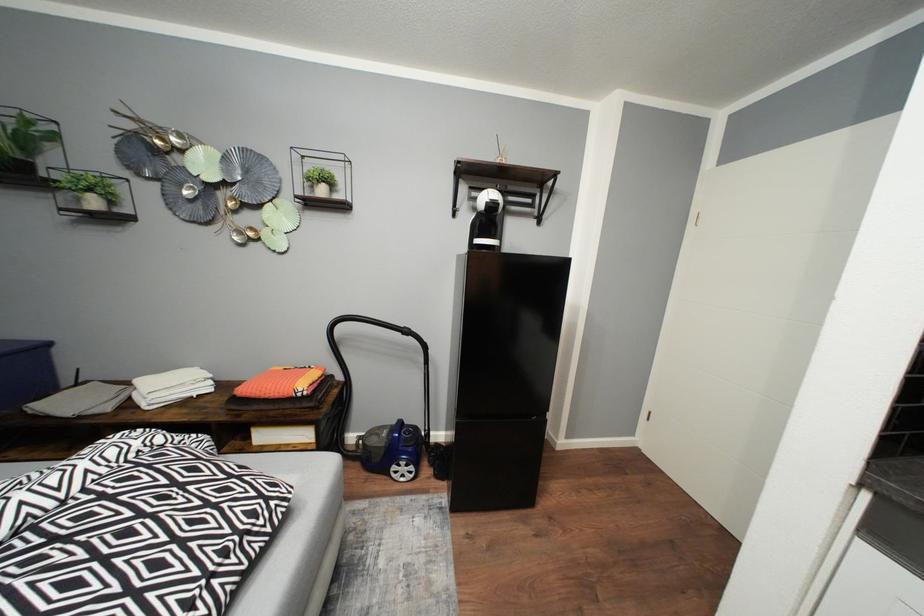
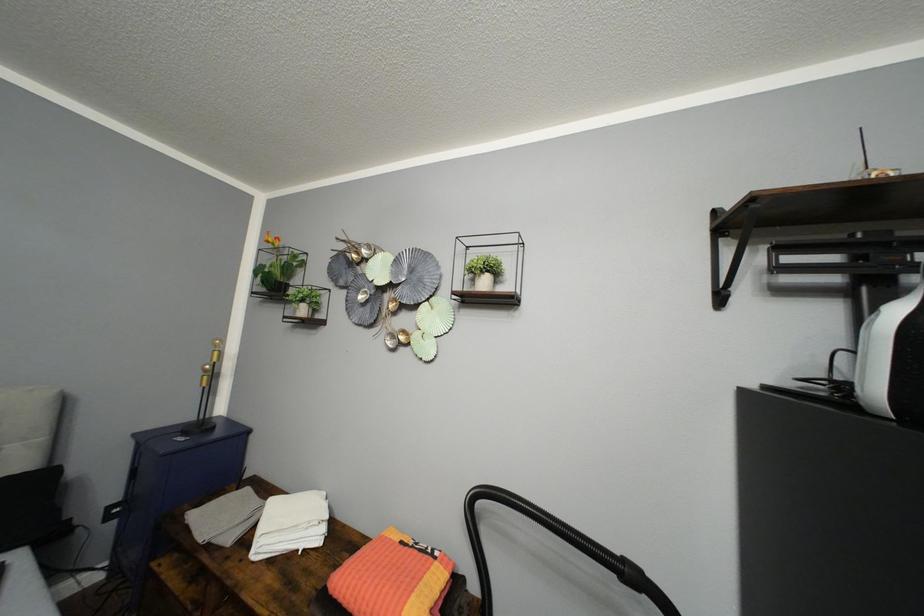
The first image is from the beginning of the video and the second image is from the end. How did the camera likely rotate when shooting the video?

The camera's rotation is toward left-up.